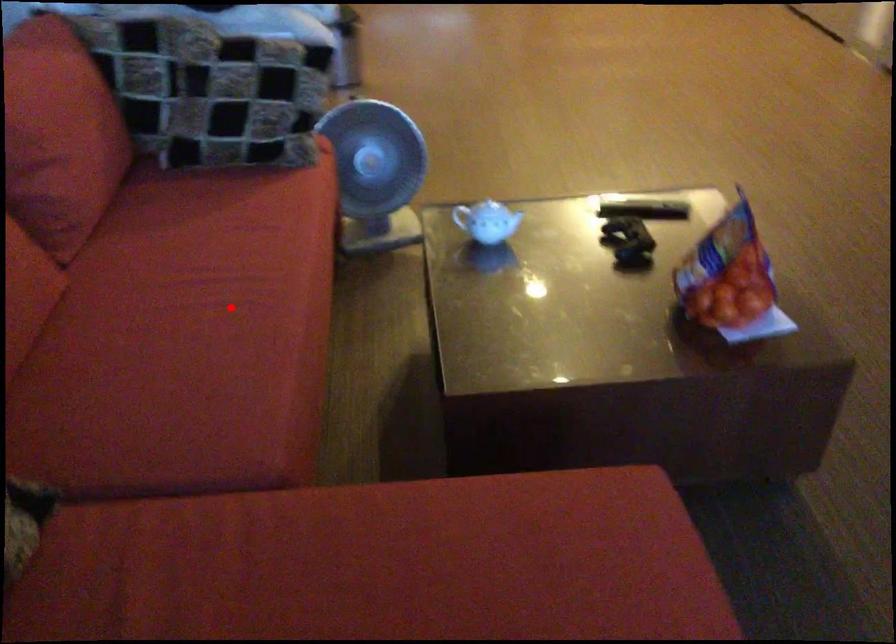
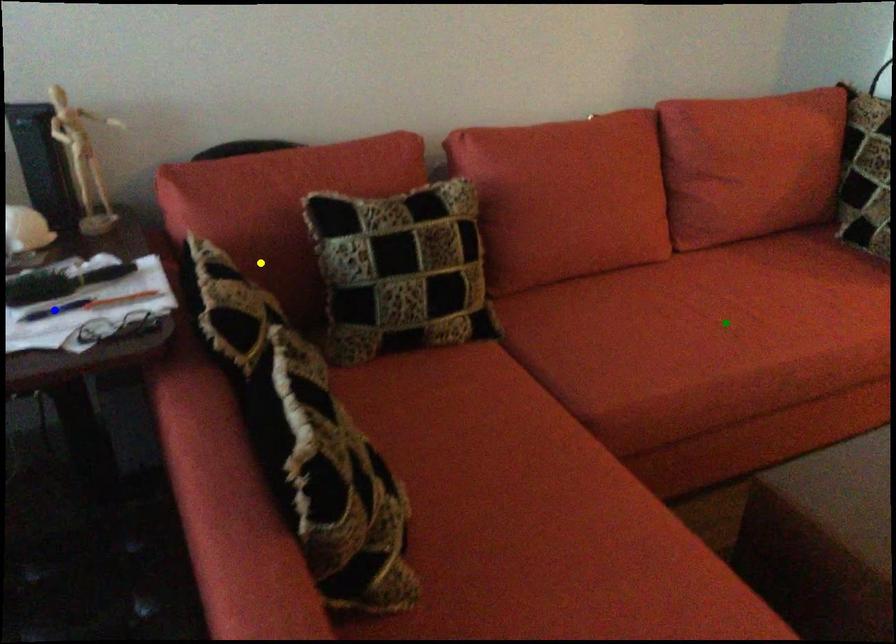
Question: I am providing you with two images of the same scene from different viewpoints. A red point is marked on the first image. You are given multiple points on the second image. Which point in image 2 represents the same 3d spot as the red point in image 1?

Choices:
 (A) green point
 (B) blue point
 (C) yellow point

Answer: (A)